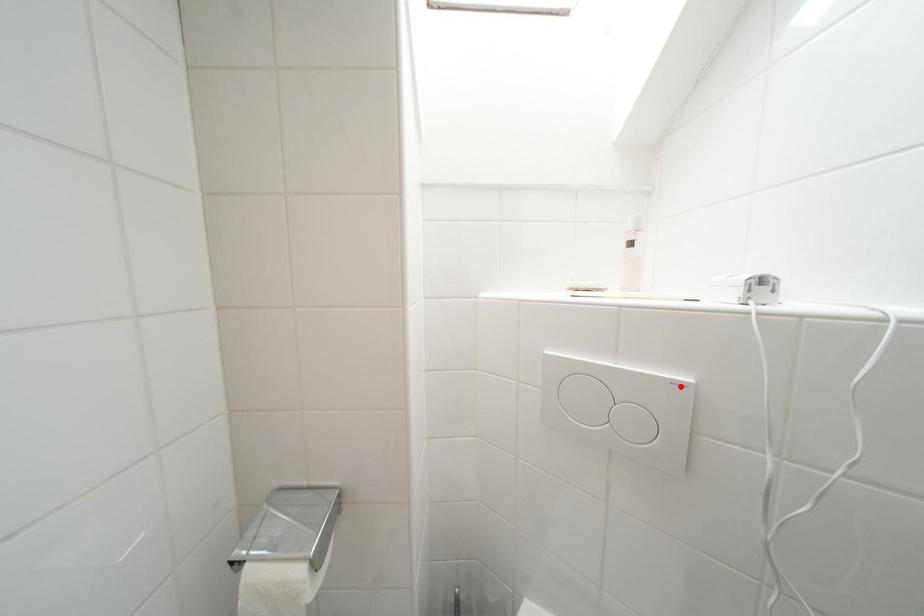
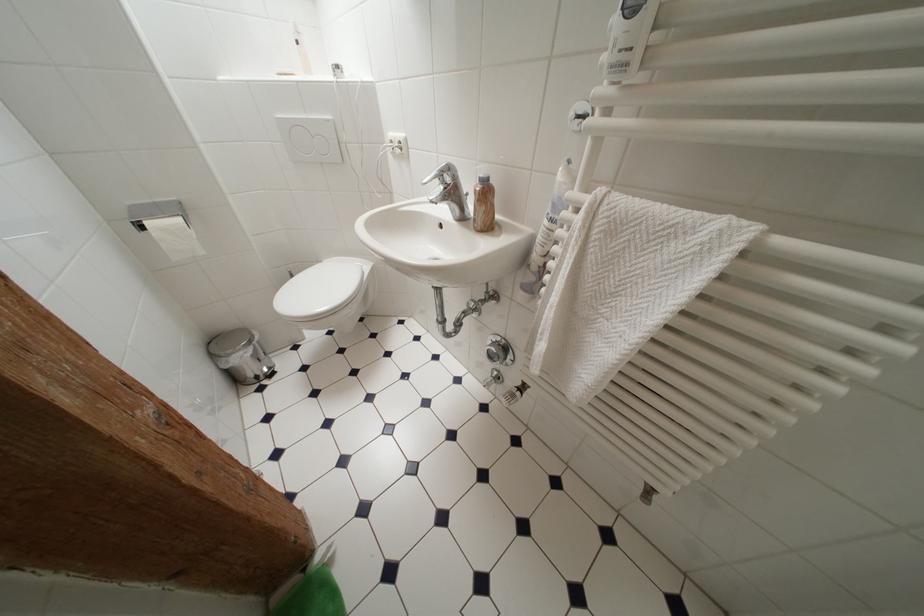
In the second image, find the point that corresponds to the highlighted location in the first image.

(333, 124)